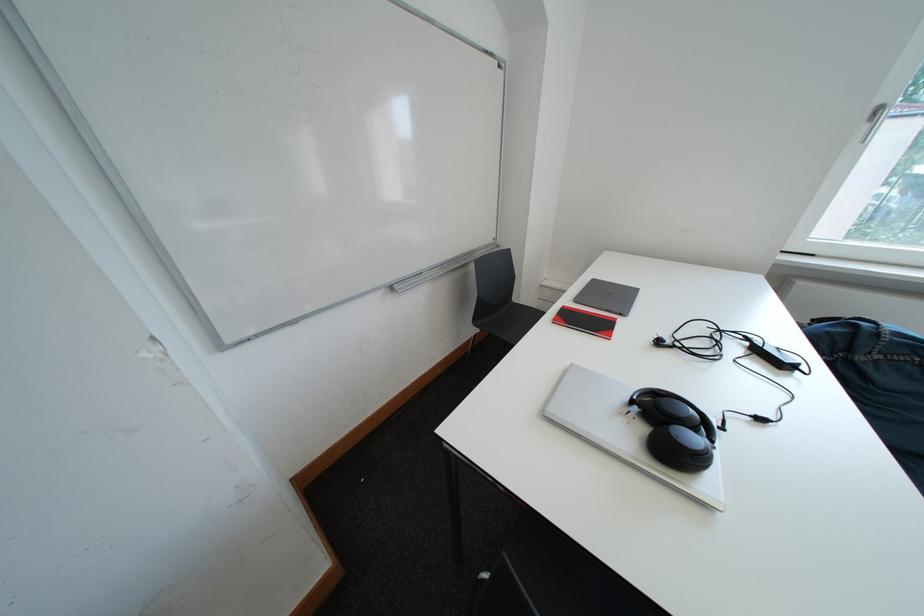
In order to click on black chair sitting surface in this screenshot , I will do `click(515, 321)`.